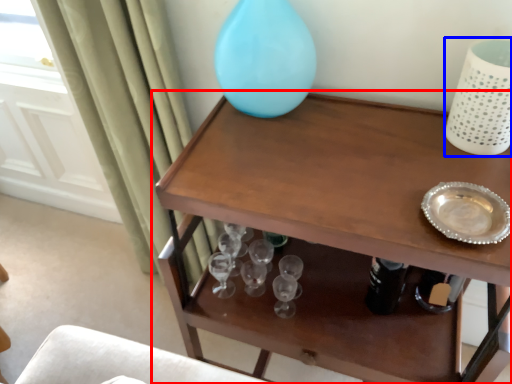
Question: Which object is further to the camera taking this photo, table (highlighted by a red box) or vase (highlighted by a blue box)?

Choices:
 (A) table
 (B) vase

Answer: (B)